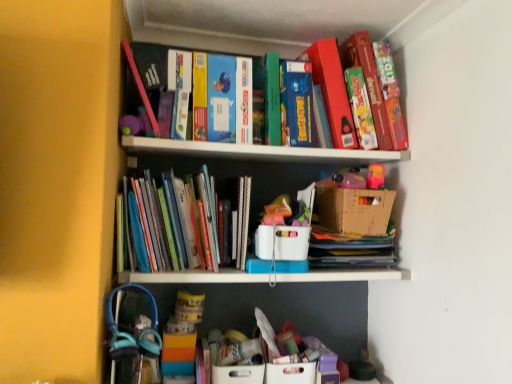
Question: Is hardcover books at center far away from white cardboard box at center, positioned as the 1th cardboard box in left-to-right order?

Choices:
 (A) yes
 (B) no

Answer: (B)

Question: Could you tell me if hardcover books at center is facing white cardboard box at center, the second cardboard box in the right-to-left sequence?

Choices:
 (A) yes
 (B) no

Answer: (B)

Question: Is hardcover books at center thinner than white cardboard box at center, the second cardboard box in the right-to-left sequence?

Choices:
 (A) no
 (B) yes

Answer: (B)

Question: From a real-world perspective, does hardcover books at center sit lower than white cardboard box at center, positioned as the 1th cardboard box in left-to-right order?

Choices:
 (A) no
 (B) yes

Answer: (A)

Question: From the image's perspective, is hardcover books at center located beneath white cardboard box at center, positioned as the 1th cardboard box in left-to-right order?

Choices:
 (A) no
 (B) yes

Answer: (A)

Question: Does hardcover books at center have a smaller size compared to white cardboard box at center, positioned as the 1th cardboard box in left-to-right order?

Choices:
 (A) yes
 (B) no

Answer: (B)

Question: Is cardboard box at upper center, placed as the second cardboard box when sorted from left to right, facing away from hardcover books at center?

Choices:
 (A) yes
 (B) no

Answer: (B)

Question: Does cardboard box at upper center, which is the first cardboard box in right-to-left order, have a larger size compared to hardcover books at center?

Choices:
 (A) yes
 (B) no

Answer: (B)

Question: Does cardboard box at upper center, which is the first cardboard box in right-to-left order, have a greater height compared to hardcover books at center?

Choices:
 (A) yes
 (B) no

Answer: (B)

Question: Does cardboard box at upper center, which is the first cardboard box in right-to-left order, lie in front of hardcover books at center?

Choices:
 (A) yes
 (B) no

Answer: (B)

Question: From a real-world perspective, is cardboard box at upper center, placed as the second cardboard box when sorted from left to right, positioned under hardcover books at center based on gravity?

Choices:
 (A) yes
 (B) no

Answer: (B)

Question: Does cardboard box at upper center, placed as the second cardboard box when sorted from left to right, turn towards hardcover books at center?

Choices:
 (A) no
 (B) yes

Answer: (A)

Question: Considering the relative sizes of cardboard box at upper center, which is the first cardboard box in right-to-left order, and white cardboard box at center, positioned as the 1th cardboard box in left-to-right order, in the image provided, is cardboard box at upper center, which is the first cardboard box in right-to-left order, shorter than white cardboard box at center, positioned as the 1th cardboard box in left-to-right order,?

Choices:
 (A) yes
 (B) no

Answer: (B)